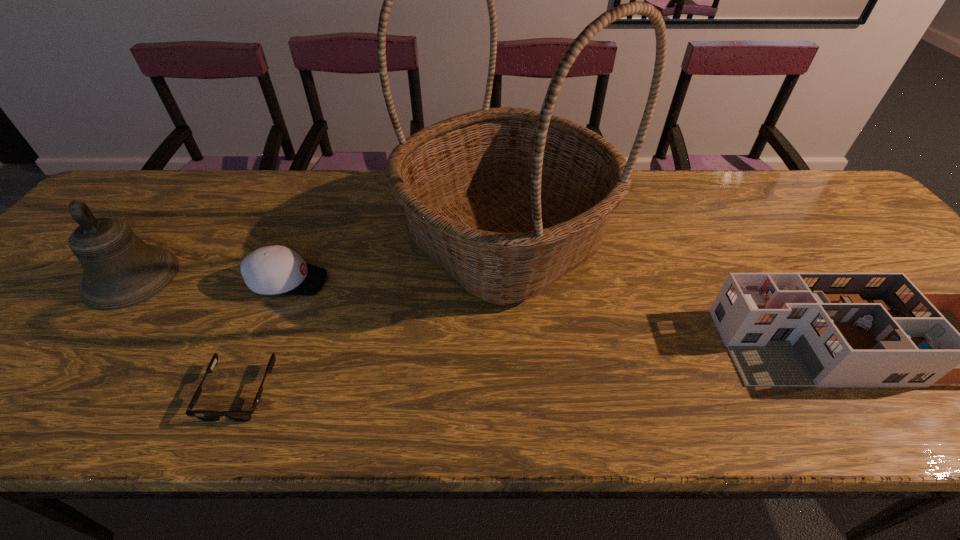
The height and width of the screenshot is (540, 960). Identify the location of object that is at the near edge. (236, 415).

This screenshot has height=540, width=960. Find the location of `object that is at the left edge`. object that is at the left edge is located at coordinates (120, 270).

I want to click on vacant space at the far edge, so click(372, 189).

This screenshot has height=540, width=960. I want to click on vacant space at the near edge of the desktop, so click(x=731, y=427).

This screenshot has height=540, width=960. In order to click on vacant region at the right edge of the desktop in this screenshot , I will do `click(873, 245)`.

The image size is (960, 540). In order to click on vacant space at the far left corner in this screenshot , I will do `click(130, 187)`.

In the image, there is a desktop. Identify the location of vacant space at the far right corner. (814, 173).

The height and width of the screenshot is (540, 960). I want to click on vacant space in between the fourth tallest object and the sunglasses, so click(264, 337).

The height and width of the screenshot is (540, 960). Identify the location of free space between the second shortest object and the sunglasses. (264, 337).

Locate an element on the screen. vacant point located between the tallest object and the leftmost object is located at coordinates (318, 258).